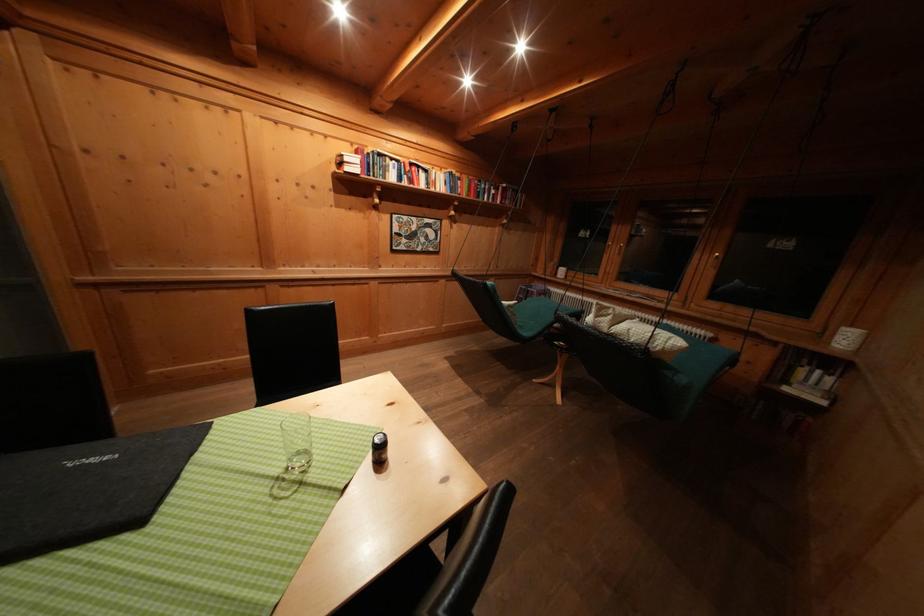
What do you see at coordinates (297, 440) in the screenshot? I see `the clear glass cup` at bounding box center [297, 440].